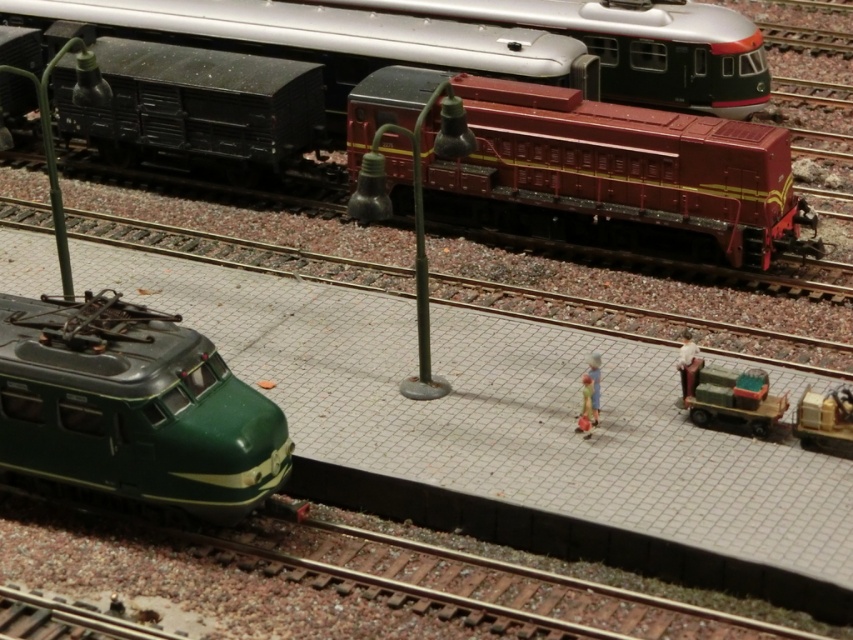
You are a model railway enthusiast observing the scene. You notice the maroon glossy locomotive at center and the metallic silver train at upper center. Which of these two trains is positioned closer to your viewpoint?

The maroon glossy locomotive at center is closer to the viewer than the metallic silver train at upper center.

You are a passenger on the green glossy train at lower left and want to see the maroon metallic locomotive at upper center. Can you see it from your current position?

The green glossy train at lower left is behind the maroon metallic locomotive at upper center, so you cannot see it from your current position.